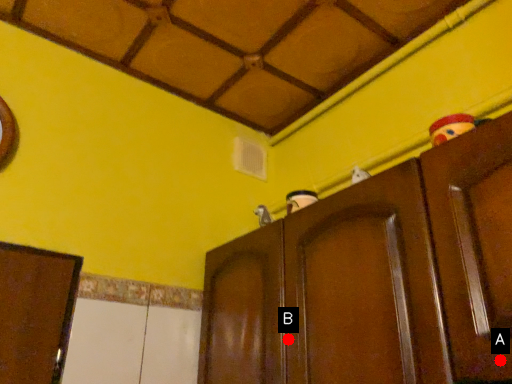
Question: Two points are circled on the image, labeled by A and B beside each circle. Which point appears closest to the camera in this image?

Choices:
 (A) A is closer
 (B) B is closer

Answer: (A)